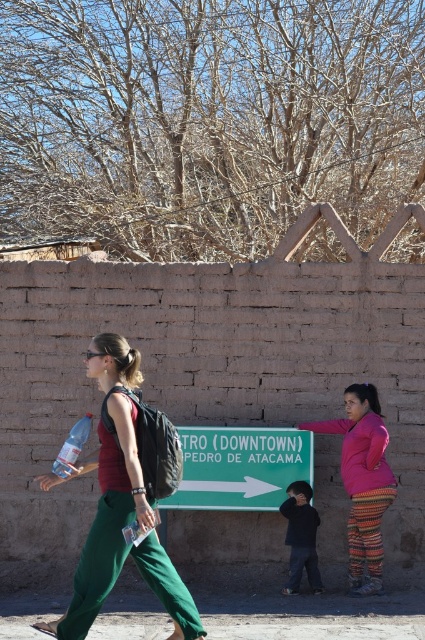
Question: Which object is the farthest from the green plastic sign at center?

Choices:
 (A) pink knitted sweater at right
 (B) dark blue sweater at center
 (C) matte red shirt at center

Answer: (C)

Question: Is matte red shirt at center to the left of pink knitted sweater at right from the viewer's perspective?

Choices:
 (A) yes
 (B) no

Answer: (A)

Question: Is green plastic sign at center bigger than pink knitted sweater at right?

Choices:
 (A) yes
 (B) no

Answer: (B)

Question: Can you confirm if pink knitted sweater at right is positioned below dark blue sweater at center?

Choices:
 (A) yes
 (B) no

Answer: (B)

Question: Among these points, which one is farthest from the camera?

Choices:
 (A) (266, 486)
 (B) (50, 484)
 (C) (348, 442)
 (D) (286, 541)

Answer: (A)

Question: Which of the following is the farthest from the observer?

Choices:
 (A) dark blue sweater at center
 (B) green plastic sign at center
 (C) matte red shirt at center
 (D) pink knitted sweater at right

Answer: (B)